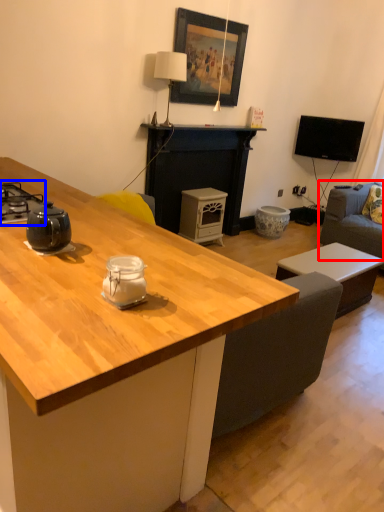
Question: Which object appears farthest to the camera in this image, studio couch (highlighted by a red box) or gas stove (highlighted by a blue box)?

Choices:
 (A) studio couch
 (B) gas stove

Answer: (A)